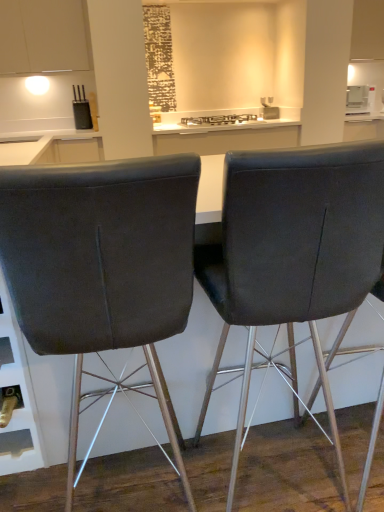
Question: Which direction should I rotate to look at matte black chair at center, the 1th chair from the right?

Choices:
 (A) right
 (B) left

Answer: (A)

Question: Considering the relative sizes of dark gray fabric chair at center, which is the 1th chair in left-to-right order, and matte black chair at center, the 1th chair from the right, in the image provided, is dark gray fabric chair at center, which is the 1th chair in left-to-right order, smaller than matte black chair at center, the 1th chair from the right,?

Choices:
 (A) no
 (B) yes

Answer: (A)

Question: Is dark gray fabric chair at center, which is the 1th chair in left-to-right order, closer to camera compared to matte black chair at center, placed as the 2th chair when sorted from left to right?

Choices:
 (A) yes
 (B) no

Answer: (A)

Question: Considering the relative sizes of dark gray fabric chair at center, which is counted as the 2th chair, starting from the right, and matte black chair at center, placed as the 2th chair when sorted from left to right, in the image provided, is dark gray fabric chair at center, which is counted as the 2th chair, starting from the right, thinner than matte black chair at center, placed as the 2th chair when sorted from left to right,?

Choices:
 (A) no
 (B) yes

Answer: (A)

Question: Does dark gray fabric chair at center, which is counted as the 2th chair, starting from the right, have a greater width compared to matte black chair at center, placed as the 2th chair when sorted from left to right?

Choices:
 (A) yes
 (B) no

Answer: (A)

Question: Can we say dark gray fabric chair at center, which is counted as the 2th chair, starting from the right, lies outside matte black chair at center, the 1th chair from the right?

Choices:
 (A) no
 (B) yes

Answer: (B)

Question: Can you confirm if dark gray fabric chair at center, which is counted as the 2th chair, starting from the right, is shorter than matte black chair at center, the 1th chair from the right?

Choices:
 (A) yes
 (B) no

Answer: (B)

Question: Does metallic silver gas stove at center have a lesser height compared to dark gray fabric chair at center, which is counted as the 2th chair, starting from the right?

Choices:
 (A) yes
 (B) no

Answer: (A)

Question: Is dark gray fabric chair at center, which is counted as the 2th chair, starting from the right, at the back of metallic silver gas stove at center?

Choices:
 (A) no
 (B) yes

Answer: (A)

Question: Is metallic silver gas stove at center further to the viewer compared to dark gray fabric chair at center, which is the 1th chair in left-to-right order?

Choices:
 (A) yes
 (B) no

Answer: (A)

Question: Is metallic silver gas stove at center positioned far away from dark gray fabric chair at center, which is counted as the 2th chair, starting from the right?

Choices:
 (A) yes
 (B) no

Answer: (A)

Question: Is metallic silver gas stove at center to the right of dark gray fabric chair at center, which is counted as the 2th chair, starting from the right, from the viewer's perspective?

Choices:
 (A) yes
 (B) no

Answer: (A)

Question: Can you confirm if metallic silver gas stove at center is taller than dark gray fabric chair at center, which is the 1th chair in left-to-right order?

Choices:
 (A) yes
 (B) no

Answer: (B)

Question: Is metallic silver gas stove at center thinner than matte black chair at center, placed as the 2th chair when sorted from left to right?

Choices:
 (A) no
 (B) yes

Answer: (B)